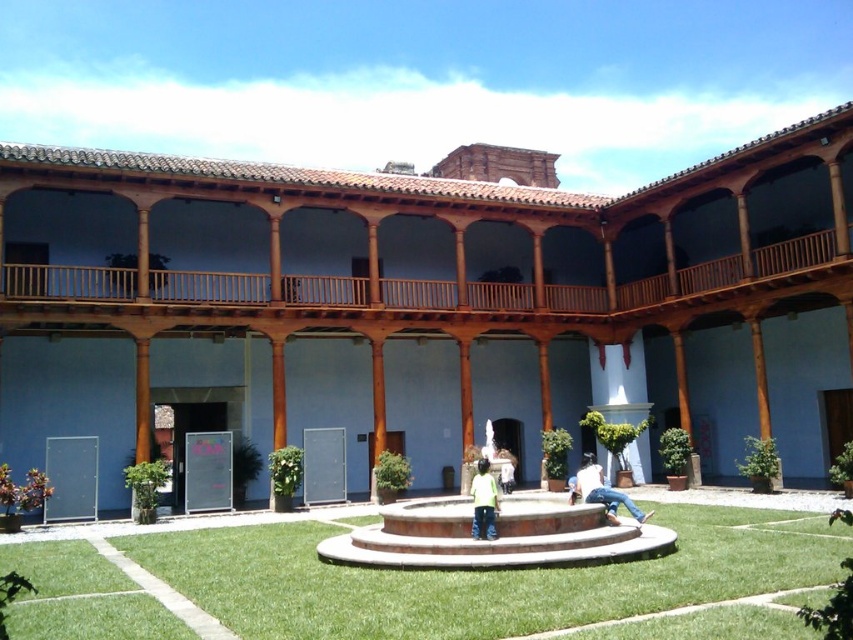
You are standing in the courtyard and want to walk from the point marked as point (112, 566) to the point marked as point (579, 486). Which direction should you face to move towards your destination?

You should face towards the direction of the fountain because point (112, 566) is in front of point (579, 486), meaning the destination is behind the fountain relative to your starting position.